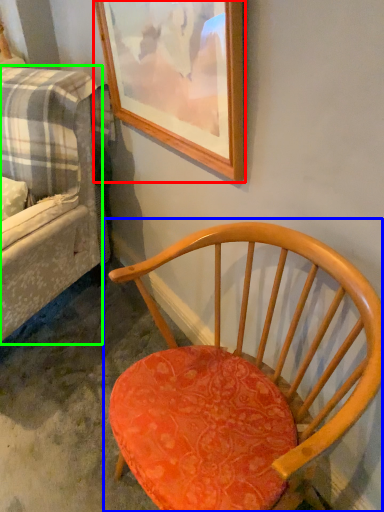
Question: Which object is the farthest from picture frame (highlighted by a red box)? Choose among these: chair (highlighted by a blue box) or studio couch (highlighted by a green box).

Choices:
 (A) chair
 (B) studio couch

Answer: (A)